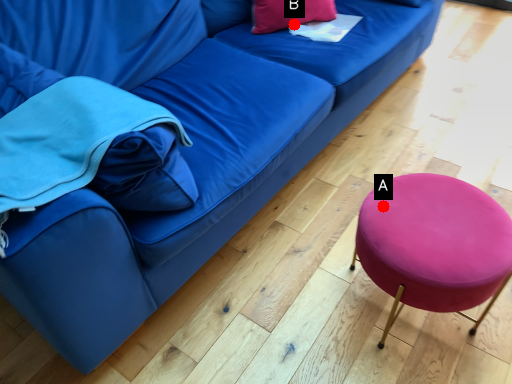
Question: Two points are circled on the image, labeled by A and B beside each circle. Which point is further to the camera?

Choices:
 (A) A is further
 (B) B is further

Answer: (B)